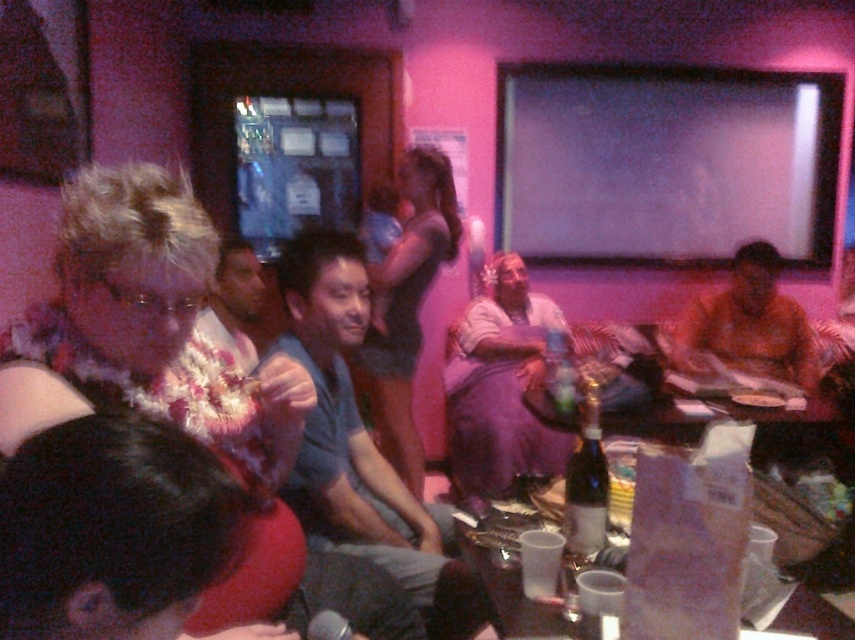
Question: Which point appears farthest from the camera in this image?

Choices:
 (A) (496, 493)
 (B) (413, 461)
 (C) (570, 552)

Answer: (B)

Question: Is purple fabric dress at center bigger than smooth brown shirt at right?

Choices:
 (A) yes
 (B) no

Answer: (A)

Question: Is dark purple dress at center below bottled champagne at center?

Choices:
 (A) no
 (B) yes

Answer: (A)

Question: Which object appears closest to the camera in this image?

Choices:
 (A) white floral lei at center
 (B) smooth brown shirt at right
 (C) bottled champagne at center
 (D) gray cotton shirt at center

Answer: (A)

Question: From the image, what is the correct spatial relationship of beige fabric shirt at center in relation to bottled champagne at center?

Choices:
 (A) below
 (B) above

Answer: (B)

Question: Which point appears closest to the camera in this image?

Choices:
 (A) (522, 308)
 (B) (248, 364)
 (C) (346, 314)
 (D) (603, 461)

Answer: (D)